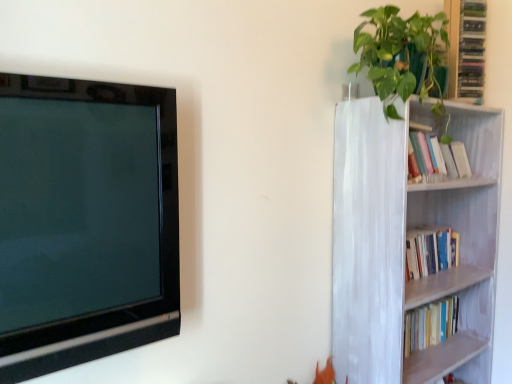
Question: Is green glossy cabinet at upper right far from black glossy television at left?

Choices:
 (A) no
 (B) yes

Answer: (B)

Question: Does green glossy cabinet at upper right have a smaller size compared to black glossy television at left?

Choices:
 (A) yes
 (B) no

Answer: (A)

Question: Can you confirm if green glossy cabinet at upper right is bigger than black glossy television at left?

Choices:
 (A) no
 (B) yes

Answer: (A)

Question: Does green glossy cabinet at upper right have a lesser height compared to black glossy television at left?

Choices:
 (A) yes
 (B) no

Answer: (A)

Question: From a real-world perspective, does green glossy cabinet at upper right stand above black glossy television at left?

Choices:
 (A) yes
 (B) no

Answer: (A)

Question: Is green glossy cabinet at upper right facing away from black glossy television at left?

Choices:
 (A) yes
 (B) no

Answer: (B)

Question: Is green glossy cabinet at upper right at the left side of green glossy plant at upper right?

Choices:
 (A) no
 (B) yes

Answer: (A)

Question: Considering the relative sizes of green glossy cabinet at upper right and green glossy plant at upper right in the image provided, is green glossy cabinet at upper right bigger than green glossy plant at upper right?

Choices:
 (A) yes
 (B) no

Answer: (B)

Question: Is green glossy cabinet at upper right facing away from green glossy plant at upper right?

Choices:
 (A) yes
 (B) no

Answer: (B)

Question: From the image's perspective, is green glossy cabinet at upper right located above green glossy plant at upper right?

Choices:
 (A) yes
 (B) no

Answer: (A)

Question: Would you say green glossy plant at upper right is part of green glossy cabinet at upper right's contents?

Choices:
 (A) no
 (B) yes

Answer: (A)

Question: From a real-world perspective, is green glossy cabinet at upper right over green glossy plant at upper right?

Choices:
 (A) yes
 (B) no

Answer: (A)

Question: Does black glossy television at left have a larger size compared to green glossy cabinet at upper right?

Choices:
 (A) yes
 (B) no

Answer: (A)